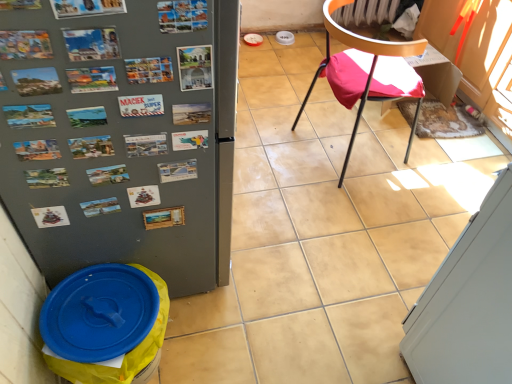
Question: From the image's perspective, is white glossy screen door at lower right positioned above or below blue plastic lid at lower left?

Choices:
 (A) above
 (B) below

Answer: (A)

Question: Considering the positions of white glossy screen door at lower right and blue plastic lid at lower left in the image, is white glossy screen door at lower right wider or thinner than blue plastic lid at lower left?

Choices:
 (A) wide
 (B) thin

Answer: (A)

Question: Estimate the real-world distances between objects in this image. Which object is farther from the white glossy screen door at lower right?

Choices:
 (A) blue plastic lid at lower left
 (B) metallic postcards at upper center
 (C) metallic gray refrigerator at left
 (D) metallic black chair at center right

Answer: (B)

Question: Which is farther from the metallic postcards at upper center?

Choices:
 (A) blue plastic lid at lower left
 (B) white glossy screen door at lower right
 (C) metallic gray refrigerator at left
 (D) metallic black chair at center right

Answer: (D)